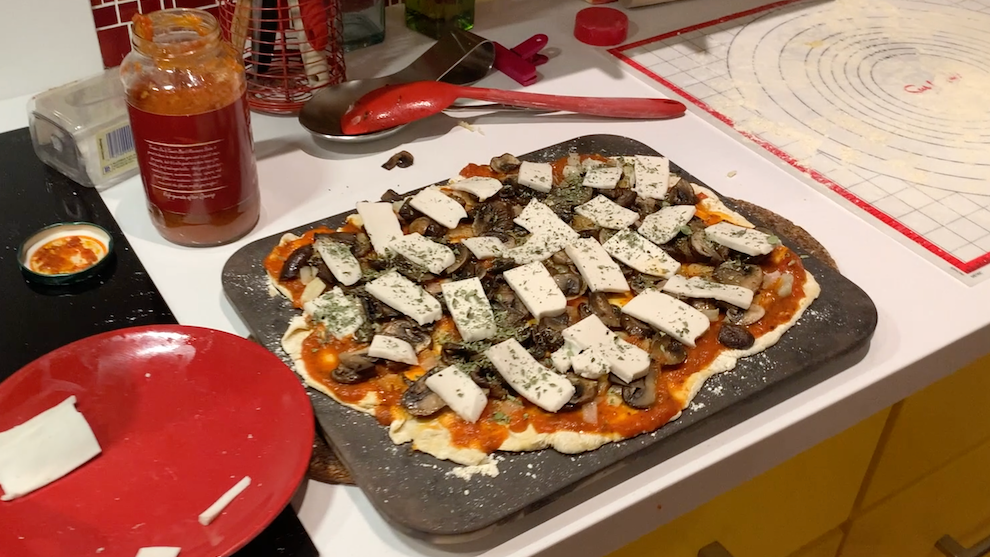
This screenshot has height=557, width=990. In order to click on cutting board in this screenshot , I will do `click(853, 332)`.